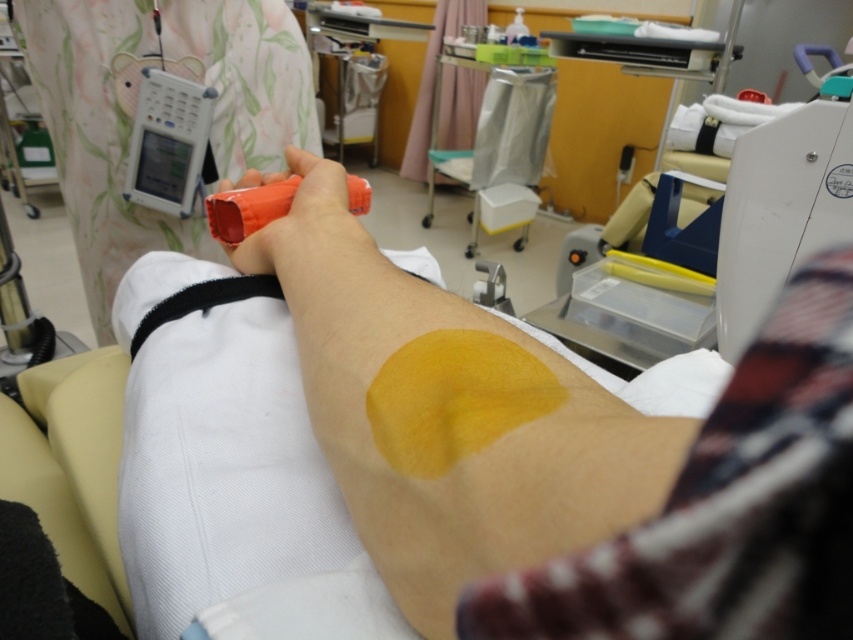
Question: Can you confirm if yellow matte patch at center is thinner than rubber-like orange marker at center?

Choices:
 (A) no
 (B) yes

Answer: (A)

Question: Is translucent orange inhaler at upper center bigger than metallic silver trash can at center?

Choices:
 (A) yes
 (B) no

Answer: (B)

Question: Which of the following is the farthest from the observer?

Choices:
 (A) (55, 93)
 (B) (352, 202)
 (C) (468, 182)

Answer: (C)

Question: Estimate the real-world distances between objects in this image. Which object is closer to the translucent orange inhaler at upper center?

Choices:
 (A) metallic silver trash can at center
 (B) yellow matte patch at center
 (C) rubber-like orange marker at center
 (D) matte plastic device at upper left

Answer: (D)

Question: From the image, what is the correct spatial relationship of matte plastic device at upper left in relation to rubber-like orange marker at center?

Choices:
 (A) above
 (B) below

Answer: (A)

Question: Which point is farther to the camera?

Choices:
 (A) metallic silver trash can at center
 (B) yellow matte patch at center

Answer: (A)